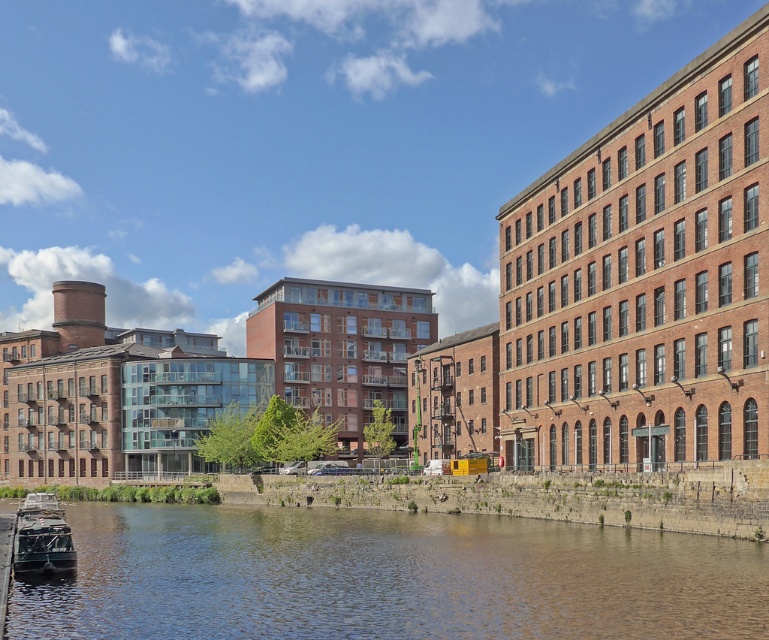
You are standing on the riverside path and see the brown stone river at lower left and the metallic gray boat at lower left. Which object is closer to the water surface?

The brown stone river at lower left is below metallic gray boat at lower left, so the brown stone river at lower left is closer to the water surface.

You are a photographer standing at the riverside. You want to capture a photo where the brown stone river at lower left and the metallic gray boat at lower left are both clearly visible. Based on their positions, which object will appear closer to the camera in the photo?

The brown stone river at lower left is in front of the metallic gray boat at lower left, so it will appear closer to the camera in the photo.

You are standing at the point with coordinates (x=385, y=577) in the image. What object are you looking at?

The point at coordinates (x=385, y=577) corresponds to the brown stone river at lower left.